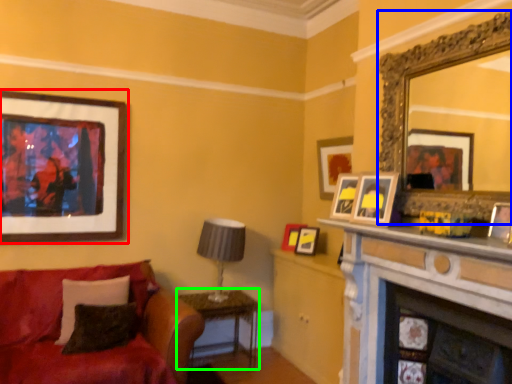
Question: Based on their relative distances, which object is nearer to picture frame (highlighted by a red box)? Choose from mirror (highlighted by a blue box) and table (highlighted by a green box).

Choices:
 (A) mirror
 (B) table

Answer: (B)